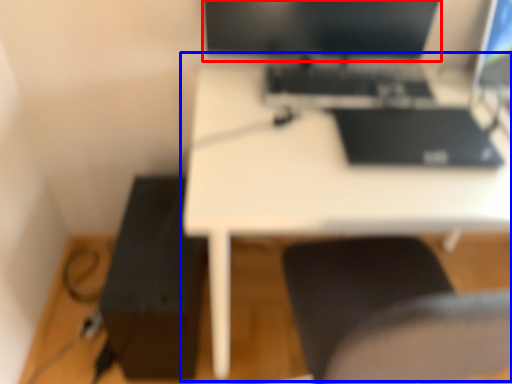
Question: Which of the following is the closest to the observer, computer monitor (highlighted by a red box) or table (highlighted by a blue box)?

Choices:
 (A) computer monitor
 (B) table

Answer: (B)